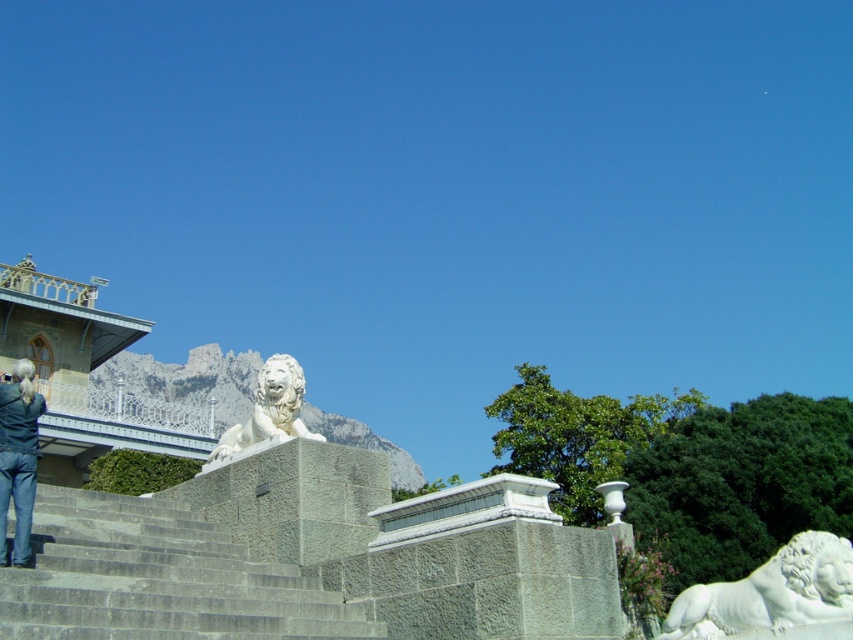
Question: Is white marble lion at lower right thinner than denim jacket at lower left?

Choices:
 (A) no
 (B) yes

Answer: (B)

Question: Does white marble lion at lower right have a smaller size compared to white marble lion at center?

Choices:
 (A) yes
 (B) no

Answer: (A)

Question: Estimate the real-world distances between objects in this image. Which object is farther from the denim jacket at lower left?

Choices:
 (A) white marble lion at center
 (B) white marble lion at lower right
 (C) gray stone stairs at center

Answer: (B)

Question: Can you confirm if white marble lion at lower right is wider than white marble lion at center?

Choices:
 (A) no
 (B) yes

Answer: (A)

Question: Which point appears closest to the camera in this image?

Choices:
 (A) (770, 620)
 (B) (189, 628)
 (C) (27, 429)
 (D) (289, 362)

Answer: (B)

Question: Which of the following is the farthest from the observer?

Choices:
 (A) denim jacket at lower left
 (B) gray stone stairs at center
 (C) white marble lion at center

Answer: (C)